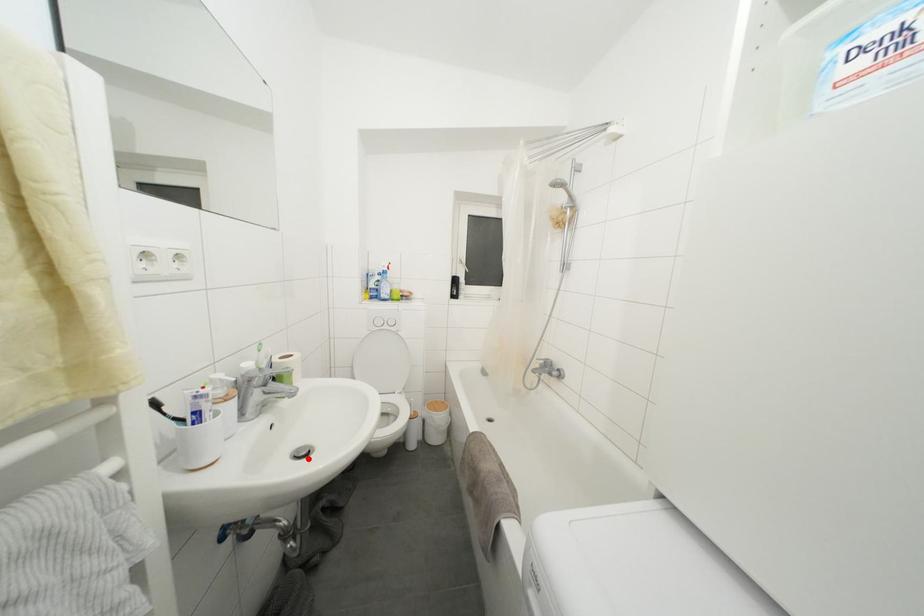
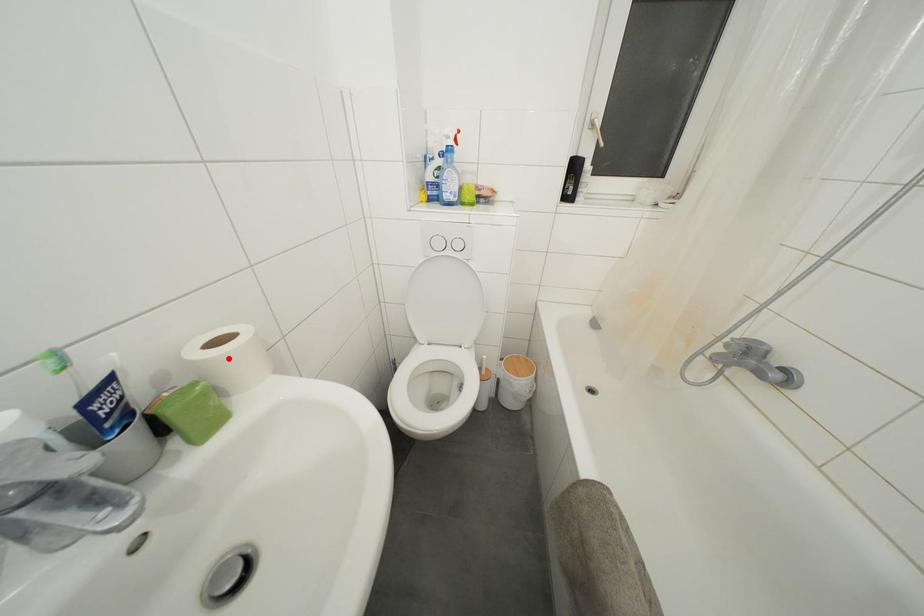
I am providing you with two images of the same scene from different viewpoints. A red point is marked on the first image and another point is marked on the second image. Does the point marked in image1 correspond to the same location as the one in image2?

No